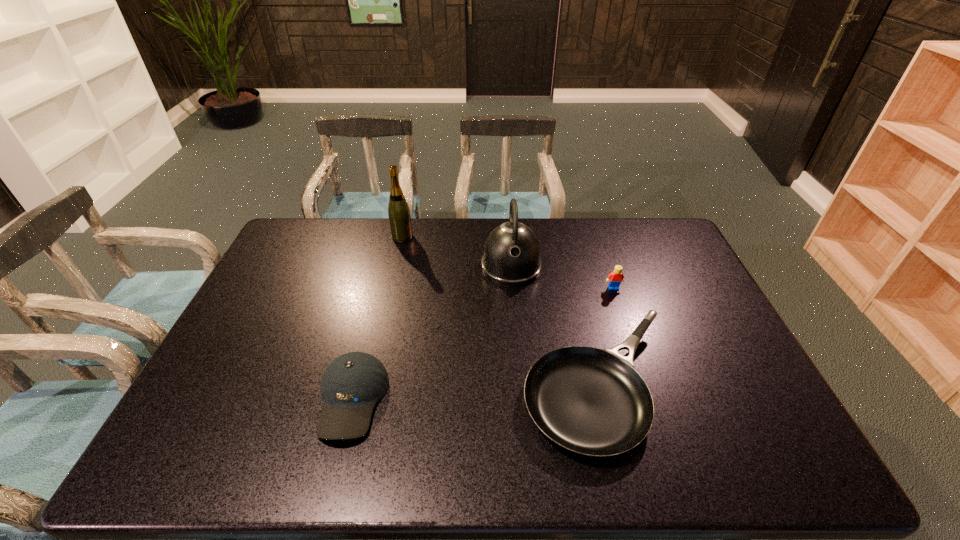
At what (x,y) coordinates should I click in order to perform the action: click on wine bottle that is at the far edge. Please return your answer as a coordinate pair (x, y). Looking at the image, I should click on (399, 215).

Where is `kettle that is at the far edge`? The width and height of the screenshot is (960, 540). kettle that is at the far edge is located at coordinates (512, 255).

Where is `baseball cap situated at the near edge`? The image size is (960, 540). baseball cap situated at the near edge is located at coordinates (352, 384).

Image resolution: width=960 pixels, height=540 pixels. I want to click on pan located at the near edge, so click(591, 401).

Image resolution: width=960 pixels, height=540 pixels. What are the coordinates of `free region at the far edge of the desktop` in the screenshot? It's located at (350, 249).

Locate an element on the screen. The width and height of the screenshot is (960, 540). vacant space at the left edge is located at coordinates (204, 418).

Image resolution: width=960 pixels, height=540 pixels. I want to click on vacant area at the right edge of the desktop, so click(684, 288).

Locate an element on the screen. Image resolution: width=960 pixels, height=540 pixels. vacant space at the far left corner of the desktop is located at coordinates (310, 219).

In the image, there is a desktop. What are the coordinates of `vacant space at the near left corner` in the screenshot? It's located at (170, 462).

Locate an element on the screen. This screenshot has width=960, height=540. free space between the fourth shortest object and the Lego is located at coordinates (563, 278).